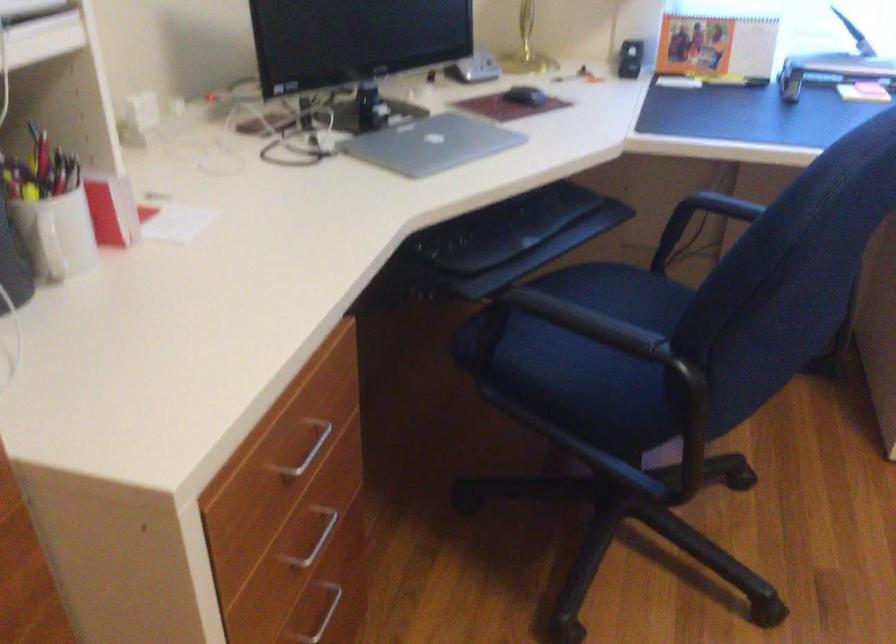
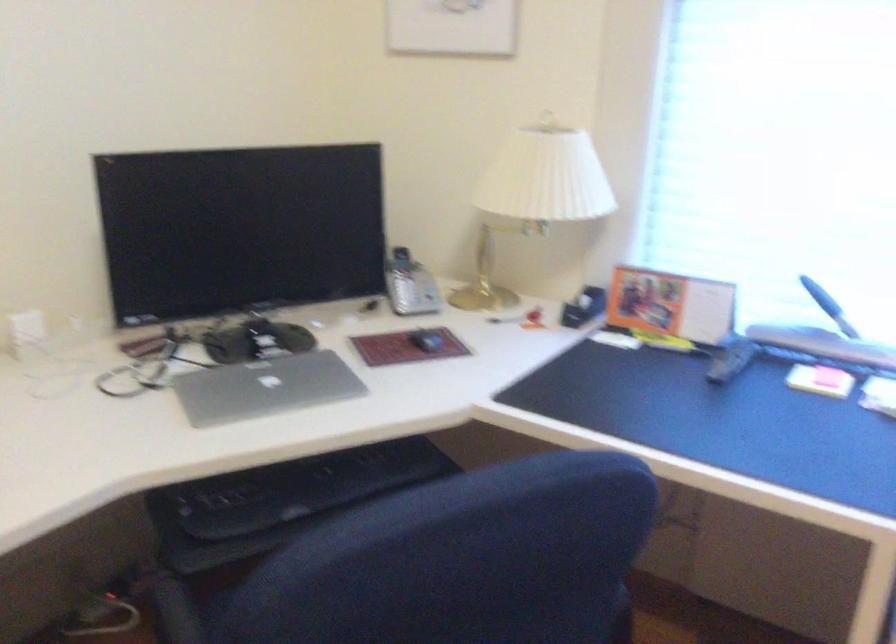
Where in the second image is the point corresponding to (x=570, y=78) from the first image?

(504, 319)